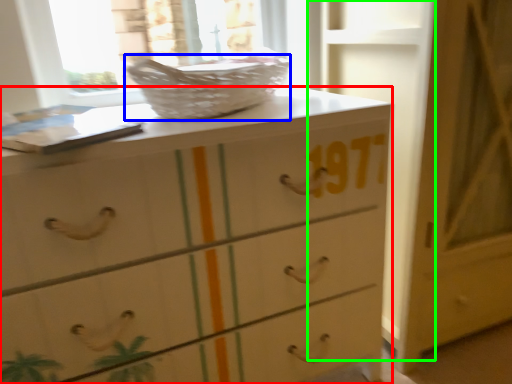
Question: Which object is positioned closest to chest of drawers (highlighted by a red box)? Select from basket (highlighted by a blue box) and door (highlighted by a green box).

Choices:
 (A) basket
 (B) door

Answer: (A)